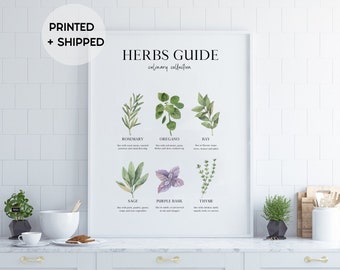
Where is `plates`? plates is located at coordinates (37, 245), (68, 245).